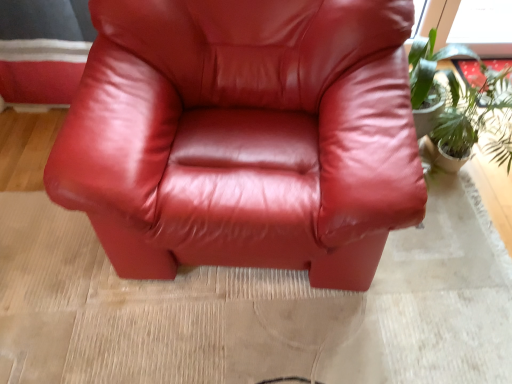
Question: Is green leafy plant at right positioned behind glossy leather chair at center?

Choices:
 (A) no
 (B) yes

Answer: (B)

Question: Does green leafy plant at right appear on the right side of glossy leather chair at center?

Choices:
 (A) no
 (B) yes

Answer: (B)

Question: Is green leafy plant at right bigger than glossy leather chair at center?

Choices:
 (A) yes
 (B) no

Answer: (B)

Question: Can you confirm if green leafy plant at right is positioned to the left of glossy leather chair at center?

Choices:
 (A) yes
 (B) no

Answer: (B)

Question: Is green leafy plant at right positioned beyond the bounds of glossy leather chair at center?

Choices:
 (A) yes
 (B) no

Answer: (A)

Question: From the image's perspective, does green leafy plant at right appear higher than glossy leather chair at center?

Choices:
 (A) yes
 (B) no

Answer: (A)

Question: From a real-world perspective, is glossy leather chair at center below green leafy plant at right?

Choices:
 (A) yes
 (B) no

Answer: (B)

Question: Is glossy leather chair at center bigger than green leafy plant at right?

Choices:
 (A) yes
 (B) no

Answer: (A)

Question: From the image's perspective, would you say glossy leather chair at center is shown under green leafy plant at right?

Choices:
 (A) yes
 (B) no

Answer: (A)

Question: Is glossy leather chair at center closer to the viewer compared to green leafy plant at right?

Choices:
 (A) yes
 (B) no

Answer: (A)

Question: Can you confirm if glossy leather chair at center is shorter than green leafy plant at right?

Choices:
 (A) yes
 (B) no

Answer: (B)

Question: Is glossy leather chair at center aimed at green leafy plant at right?

Choices:
 (A) yes
 (B) no

Answer: (B)

Question: From the image's perspective, is glossy leather chair at center located above or below green leafy plant at right?

Choices:
 (A) below
 (B) above

Answer: (A)